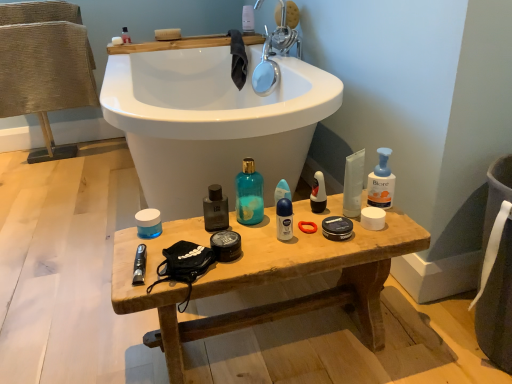
Where is `blank area beneath textured woven fabric at upper left (from a real-world perspective)`? blank area beneath textured woven fabric at upper left (from a real-world perspective) is located at coordinates (61, 148).